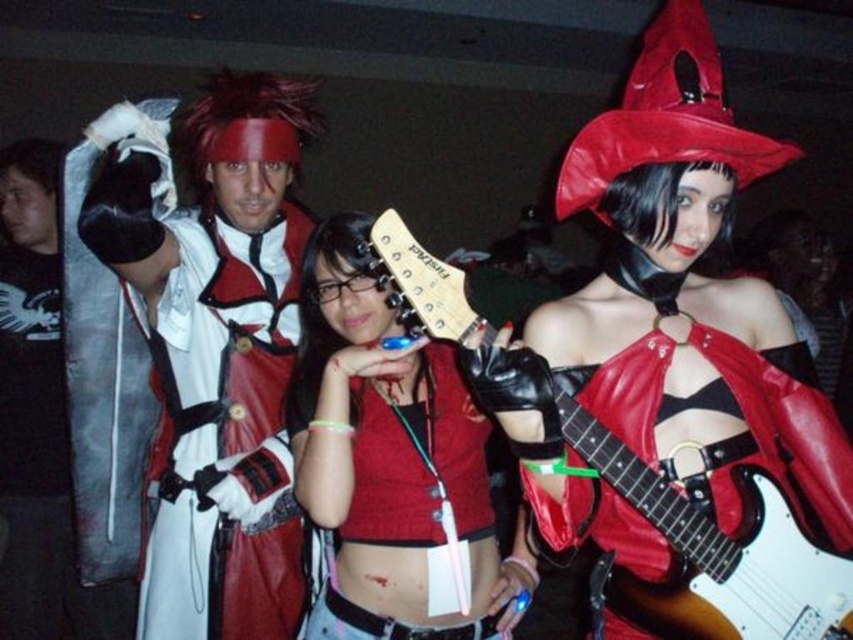
You are a photographer standing at the back of the venue. You need to capture a photo that includes both the white glossy electric guitar at center and the brushed metal sword at left. What is the minimum distance you should position yourself from the guitar to ensure both objects are in frame?

The minimum distance should be at least 1.74 meters to ensure both the white glossy electric guitar at center and the brushed metal sword at left are in frame, as they are 1.74 meters apart.

You are a photographer at the event and want to capture a shot of the white leather jacket at upper left and the white glossy electric guitar at center. Which object should you focus on first if you need to adjust your camera to account for depth of field? Please explain your reasoning based on their positions.

You should focus on the white leather jacket at upper left first because it is located above the white glossy electric guitar at center, meaning it is closer to the camera. Adjusting the depth of field starting from the closer object ensures both subjects are in focus.